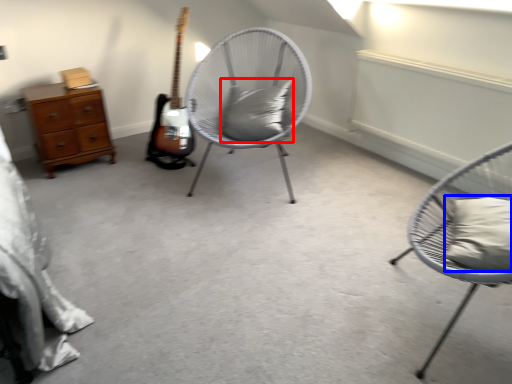
Question: Which object appears farthest to the camera in this image, pillow (highlighted by a red box) or pillow (highlighted by a blue box)?

Choices:
 (A) pillow
 (B) pillow

Answer: (A)